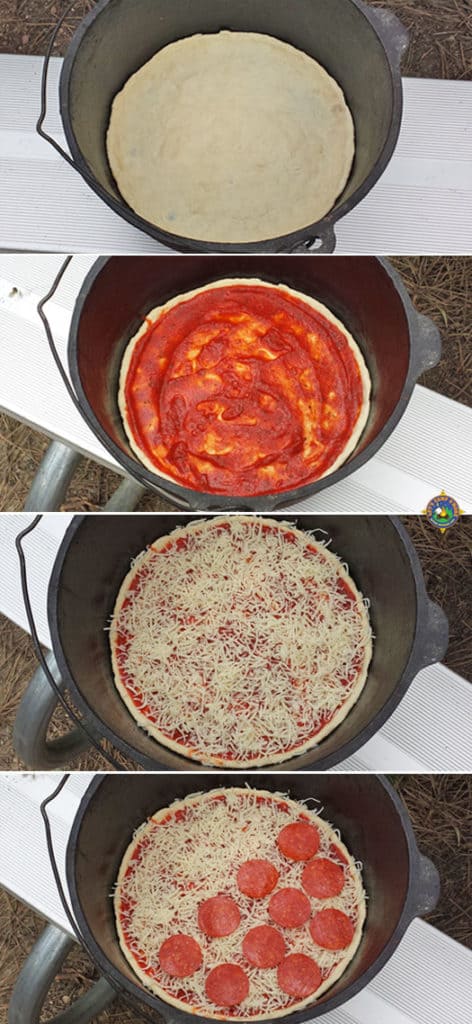
At what (x,y) coordinates should I click in order to perform the action: click on grooves on bench in last photo. Please return your answer as a coordinate pair (x, y). The width and height of the screenshot is (472, 1024). Looking at the image, I should click on (418, 970).